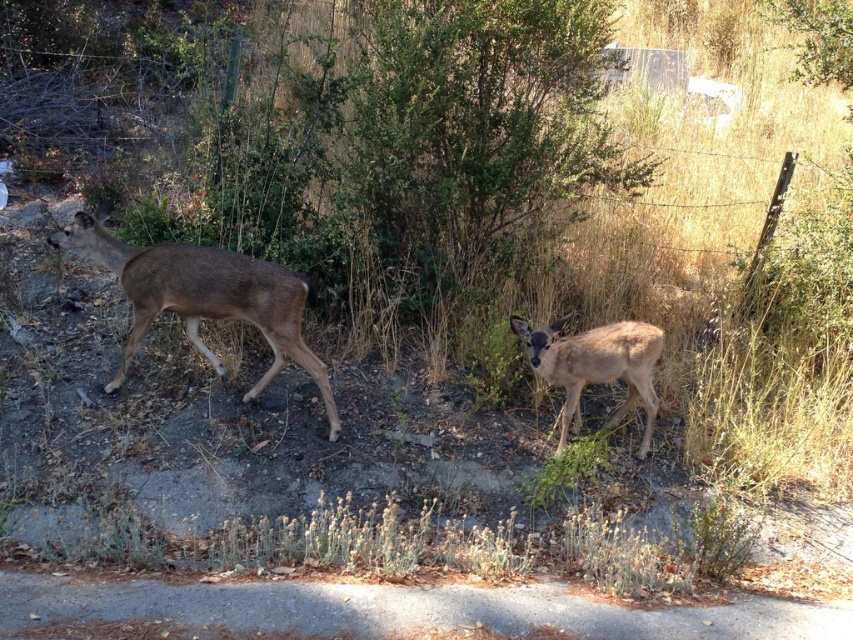
You are standing at the bottom left corner of the image, facing the center of the road. You see two points marked on the image, point (209, 356) and point (651, 422). Which point is closer to you?

Point (651, 422) is closer to you because it is in front of point (209, 356).